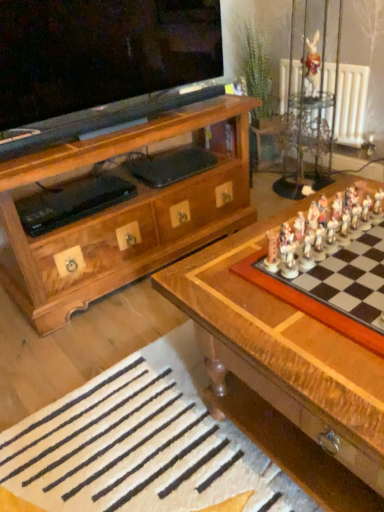
Find the location of a particular element. Image resolution: width=384 pixels, height=512 pixels. free spot above wooden chessboard at right (from a real-world perspective) is located at coordinates (344, 261).